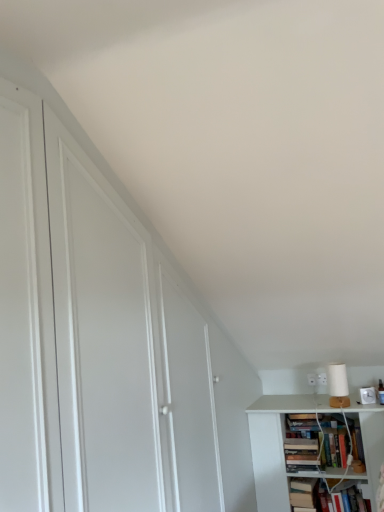
Question: Is hardcover book at lower right, which is the first book in left-to-right order, aimed at white matte lamp at upper right?

Choices:
 (A) yes
 (B) no

Answer: (B)

Question: Is hardcover book at lower right, which is the first book in left-to-right order, positioned with its back to white matte lamp at upper right?

Choices:
 (A) yes
 (B) no

Answer: (B)

Question: Is hardcover book at lower right, the second book when ordered from right to left, bigger than white matte lamp at upper right?

Choices:
 (A) no
 (B) yes

Answer: (B)

Question: Is hardcover book at lower right, the second book when ordered from right to left, to the left of white matte lamp at upper right from the viewer's perspective?

Choices:
 (A) yes
 (B) no

Answer: (A)

Question: Considering the relative sizes of hardcover book at lower right, the second book when ordered from right to left, and white matte lamp at upper right in the image provided, is hardcover book at lower right, the second book when ordered from right to left, thinner than white matte lamp at upper right?

Choices:
 (A) yes
 (B) no

Answer: (B)

Question: Would you say hardcover book at lower right, the second book when ordered from right to left, is to the left or to the right of hardcover book at lower right, which is counted as the first book, starting from the right, in the picture?

Choices:
 (A) right
 (B) left

Answer: (B)

Question: In terms of height, does hardcover book at lower right, which is the first book in left-to-right order, look taller or shorter compared to hardcover book at lower right, which ranks as the second book in left-to-right order?

Choices:
 (A) tall
 (B) short

Answer: (A)

Question: Is hardcover book at lower right, the second book when ordered from right to left, situated inside hardcover book at lower right, which is counted as the first book, starting from the right, or outside?

Choices:
 (A) inside
 (B) outside

Answer: (B)

Question: Considering their positions, is hardcover book at lower right, which is the first book in left-to-right order, located in front of or behind hardcover book at lower right, which ranks as the second book in left-to-right order?

Choices:
 (A) front
 (B) behind

Answer: (B)

Question: Considering the positions of point (316, 480) and point (329, 387), is point (316, 480) closer or farther from the camera than point (329, 387)?

Choices:
 (A) farther
 (B) closer

Answer: (B)

Question: From a real-world perspective, is hardcover book at lower right, the second book when ordered from right to left, physically located above or below white matte lamp at upper right?

Choices:
 (A) below
 (B) above

Answer: (A)

Question: Looking at the image, does hardcover book at lower right, which is the first book in left-to-right order, seem bigger or smaller compared to white matte lamp at upper right?

Choices:
 (A) big
 (B) small

Answer: (A)

Question: In terms of height, does hardcover book at lower right, which is the first book in left-to-right order, look taller or shorter compared to white matte lamp at upper right?

Choices:
 (A) short
 (B) tall

Answer: (B)

Question: From the image's perspective, is white matte lamp at upper right positioned above or below hardcover book at lower right, which is counted as the first book, starting from the right?

Choices:
 (A) below
 (B) above

Answer: (B)

Question: Do you think white matte lamp at upper right is within hardcover book at lower right, which is counted as the first book, starting from the right, or outside of it?

Choices:
 (A) outside
 (B) inside

Answer: (A)